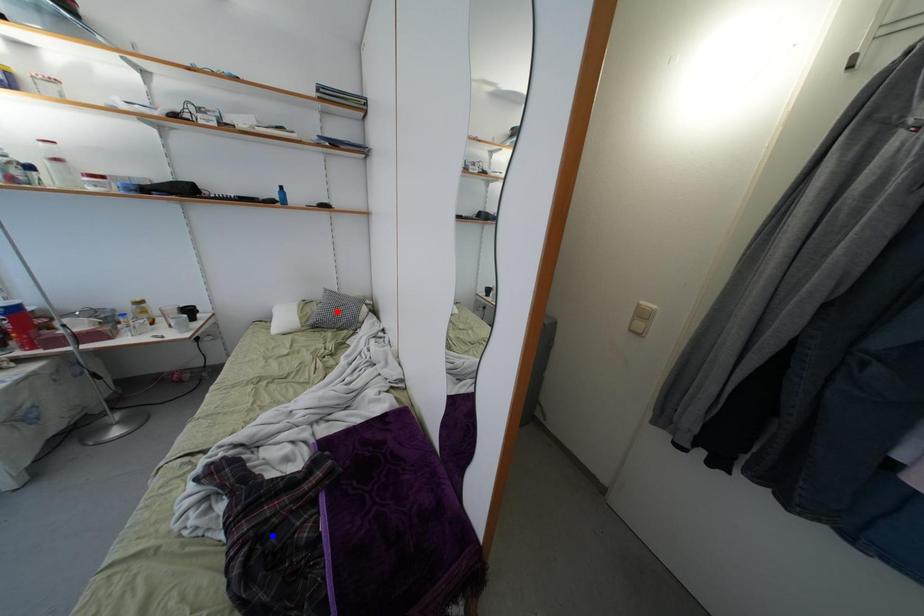
Question: Which of the two points in the image is closer to the camera?

Choices:
 (A) Blue point is closer.
 (B) Red point is closer.

Answer: (A)